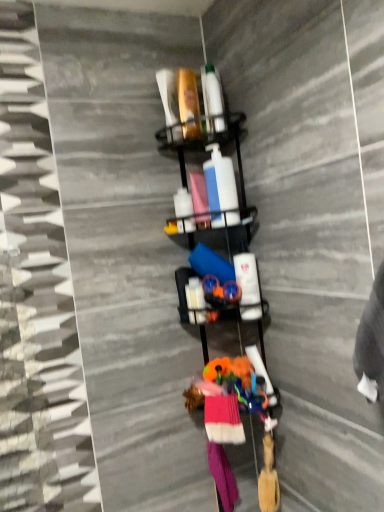
Question: Can you confirm if metallic black shelf at center is smaller than knitted wool socks at center, positioned as the 2th clothing in bottom-to-top order?

Choices:
 (A) no
 (B) yes

Answer: (A)

Question: Does metallic black shelf at center appear on the left side of knitted wool socks at center, positioned as the 2th clothing in bottom-to-top order?

Choices:
 (A) no
 (B) yes

Answer: (B)

Question: Is metallic black shelf at center bigger than knitted wool socks at center, which is the 1th clothing from front to back?

Choices:
 (A) yes
 (B) no

Answer: (A)

Question: Is metallic black shelf at center surrounding knitted wool socks at center, placed as the first clothing when sorted from top to bottom?

Choices:
 (A) no
 (B) yes

Answer: (B)

Question: From a real-world perspective, is metallic black shelf at center on knitted wool socks at center, the 2th clothing positioned from the back?

Choices:
 (A) yes
 (B) no

Answer: (A)

Question: Considering the positions of pink fabric socks at lower center, which is counted as the first clothing, starting from the back, and pink fabric at center in the image, is pink fabric socks at lower center, which is counted as the first clothing, starting from the back, bigger or smaller than pink fabric at center?

Choices:
 (A) small
 (B) big

Answer: (B)

Question: Is pink fabric socks at lower center, which is counted as the first clothing, starting from the back, in front of or behind pink fabric at center in the image?

Choices:
 (A) front
 (B) behind

Answer: (B)

Question: Is pink fabric socks at lower center, which is counted as the first clothing, starting from the back, inside or outside of pink fabric at center?

Choices:
 (A) inside
 (B) outside

Answer: (B)

Question: From the image's perspective, is pink fabric socks at lower center, which is counted as the first clothing, starting from the back, located above or below pink fabric at center?

Choices:
 (A) above
 (B) below

Answer: (B)

Question: From the image's perspective, relative to metallic black shelf at center, is pink fabric at center above or below?

Choices:
 (A) above
 (B) below

Answer: (A)

Question: Is pink fabric at center taller or shorter than metallic black shelf at center?

Choices:
 (A) short
 (B) tall

Answer: (A)

Question: Would you say pink fabric at center is inside or outside metallic black shelf at center?

Choices:
 (A) outside
 (B) inside

Answer: (B)

Question: From a real-world perspective, is pink fabric at center physically located above or below metallic black shelf at center?

Choices:
 (A) above
 (B) below

Answer: (A)

Question: From a real-world perspective, is knitted wool socks at center, the 2th clothing positioned from the back, positioned above or below metallic black shelf at center?

Choices:
 (A) above
 (B) below

Answer: (B)

Question: Looking at the image, does knitted wool socks at center, placed as the first clothing when sorted from top to bottom, seem bigger or smaller compared to metallic black shelf at center?

Choices:
 (A) small
 (B) big

Answer: (A)